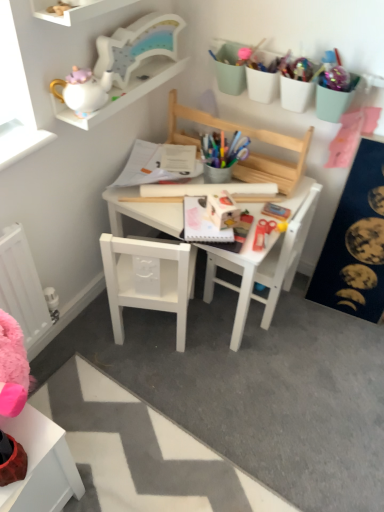
Question: Is white wooden shelf at upper left, which is the 1th shelf from front to back, facing towards white glossy teapot at upper left, which ranks as the first stationery in left-to-right order?

Choices:
 (A) no
 (B) yes

Answer: (A)

Question: Is white wooden shelf at upper left, which is the 1th shelf from front to back, closer to camera compared to white glossy teapot at upper left, which ranks as the first stationery in left-to-right order?

Choices:
 (A) yes
 (B) no

Answer: (A)

Question: Can you confirm if white wooden shelf at upper left, which is the 1th shelf from front to back, is bigger than white glossy teapot at upper left, the second stationery positioned from the back?

Choices:
 (A) yes
 (B) no

Answer: (B)

Question: Can you confirm if white wooden shelf at upper left, placed as the second shelf when sorted from back to front, is taller than white glossy teapot at upper left, the first stationery positioned from the front?

Choices:
 (A) yes
 (B) no

Answer: (B)

Question: Does white wooden shelf at upper left, placed as the second shelf when sorted from back to front, have a lesser height compared to white glossy teapot at upper left, which ranks as the first stationery in left-to-right order?

Choices:
 (A) no
 (B) yes

Answer: (B)

Question: Considering the positions of pastel green plastic containers at upper right, the second stationery from the front, and white glossy teapot at upper left, which ranks as the first stationery in left-to-right order, in the image, is pastel green plastic containers at upper right, the second stationery from the front, wider or thinner than white glossy teapot at upper left, which ranks as the first stationery in left-to-right order,?

Choices:
 (A) wide
 (B) thin

Answer: (B)

Question: Is pastel green plastic containers at upper right, the second stationery from the front, in front of or behind white glossy teapot at upper left, the first stationery positioned from the front, in the image?

Choices:
 (A) behind
 (B) front

Answer: (A)

Question: Looking at the image, does pastel green plastic containers at upper right, the second stationery from the front, seem bigger or smaller compared to white glossy teapot at upper left, the second stationery positioned from the back?

Choices:
 (A) small
 (B) big

Answer: (A)

Question: Considering the positions of point (261, 69) and point (54, 83), is point (261, 69) closer or farther from the camera than point (54, 83)?

Choices:
 (A) closer
 (B) farther

Answer: (B)

Question: Considering the relative positions of white wooden table at center and white glossy teapot at upper left, the second stationery positioned from the back, in the image provided, is white wooden table at center to the left or to the right of white glossy teapot at upper left, the second stationery positioned from the back,?

Choices:
 (A) right
 (B) left

Answer: (A)

Question: Is point (183, 348) closer or farther from the camera than point (107, 74)?

Choices:
 (A) closer
 (B) farther

Answer: (B)

Question: Is white wooden table at center in front of or behind white glossy teapot at upper left, which ranks as the first stationery in left-to-right order, in the image?

Choices:
 (A) behind
 (B) front

Answer: (A)

Question: Considering the positions of white wooden table at center and white glossy teapot at upper left, the second stationery positioned from the back, in the image, is white wooden table at center taller or shorter than white glossy teapot at upper left, the second stationery positioned from the back,?

Choices:
 (A) short
 (B) tall

Answer: (B)

Question: Would you say white matte chair at lower left, the 1th chair from the left, is to the left or to the right of white wooden table at center in the picture?

Choices:
 (A) right
 (B) left

Answer: (B)

Question: In the image, is white matte chair at lower left, the 1th chair from the left, positioned in front of or behind white wooden table at center?

Choices:
 (A) front
 (B) behind

Answer: (A)